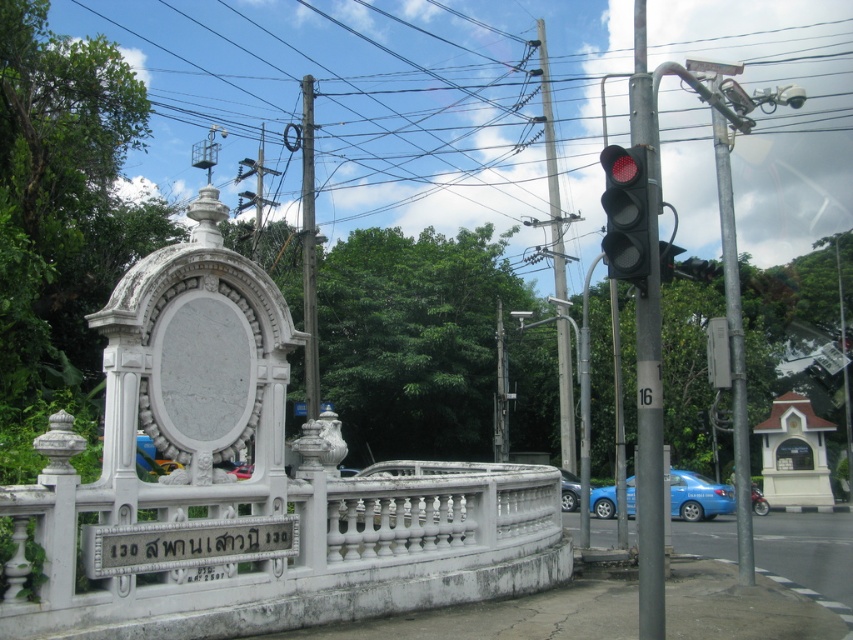
You are a pedestrian standing at the crosswalk and see the white stone sign at lower center and the blue metallic car at lower right. Which object is closer to you?

The white stone sign at lower center is closer to you since it is in front of the blue metallic car at lower right.

You are a photographer trying to capture the traffic light and the historical structure in the background. You notice two points marked on your camera screen at coordinates point (680, 512) and point (759, 493). Which of these points is closer to your camera lens?

Point (680, 512) is closer to the camera lens than point (759, 493).